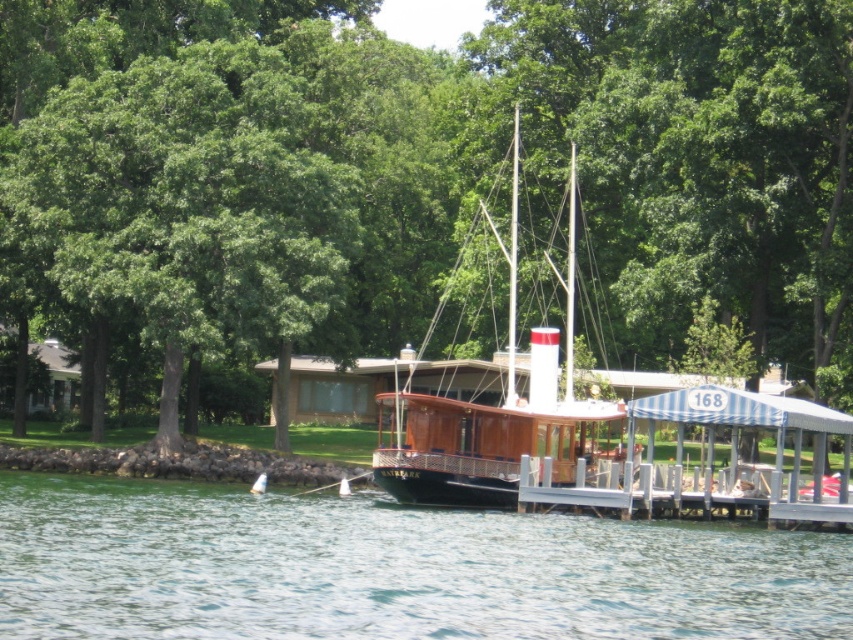
Between point (219, 628) and point (402, 420), which one is positioned in front?

Point (219, 628)

Is point (204, 579) in front of point (543, 388)?

Yes, point (204, 579) is in front of point (543, 388).

Where is `clear water at center`? clear water at center is located at coordinates (390, 568).

Can you confirm if green leafy tree at center is positioned above wooden boat at center?

Correct, green leafy tree at center is located above wooden boat at center.

Can you confirm if green leafy tree at center is positioned below wooden boat at center?

No, green leafy tree at center is not below wooden boat at center.

This screenshot has height=640, width=853. What do you see at coordinates (421, 186) in the screenshot? I see `green leafy tree at center` at bounding box center [421, 186].

At what (x,y) coordinates should I click in order to perform the action: click on green leafy tree at center. Please return your answer as a coordinate pair (x, y). This screenshot has width=853, height=640. Looking at the image, I should click on (421, 186).

Is clear water at center above white striped wood dock at center?

Incorrect, clear water at center is not positioned above white striped wood dock at center.

Is point (407, 627) more distant than point (682, 444)?

No, (407, 627) is in front of (682, 444).

What do you see at coordinates (390, 568) in the screenshot? I see `clear water at center` at bounding box center [390, 568].

The width and height of the screenshot is (853, 640). Identify the location of clear water at center. (390, 568).